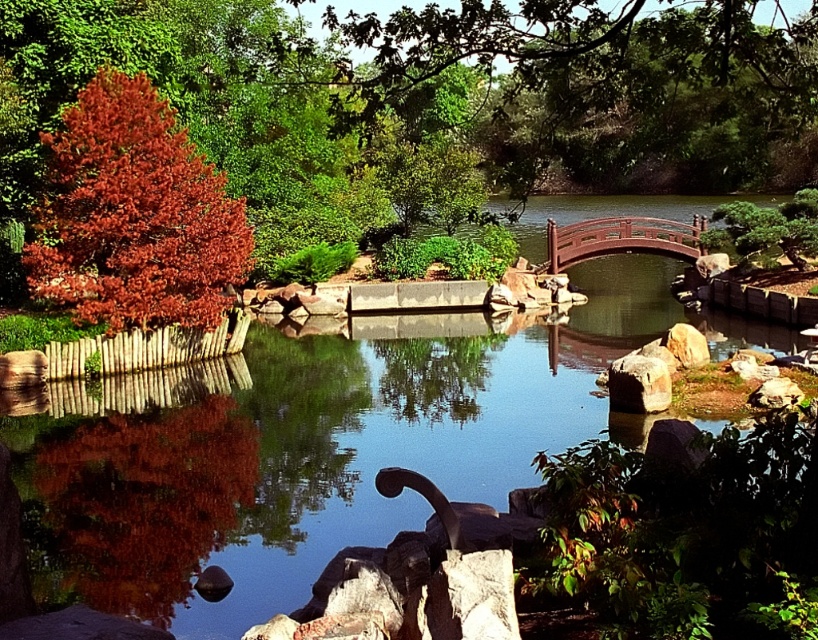
Is shiny red tree at left taller than wooden bridge at center?

Yes, shiny red tree at left is taller than wooden bridge at center.

Locate an element on the screen. The width and height of the screenshot is (818, 640). shiny red tree at left is located at coordinates (133, 216).

In order to click on shiny red tree at left in this screenshot , I will do `click(133, 216)`.

From the picture: Is shiny red tree at left behind rusty metallic rock at lower right?

Yes, it is.

Is shiny red tree at left to the left of rusty metallic rock at lower right from the viewer's perspective?

Correct, you'll find shiny red tree at left to the left of rusty metallic rock at lower right.

This screenshot has height=640, width=818. I want to click on shiny red tree at left, so click(x=133, y=216).

This screenshot has height=640, width=818. Identify the location of shiny red tree at left. click(133, 216).

Is point (601, 252) positioned in front of point (645, 390)?

No, (601, 252) is behind (645, 390).

Is wooden bridge at center above rusty metallic rock at lower right?

Correct, wooden bridge at center is located above rusty metallic rock at lower right.

Is point (679, 241) less distant than point (616, 406)?

No, (679, 241) is further to viewer.

Find the location of a particular element. The image size is (818, 640). wooden bridge at center is located at coordinates (619, 240).